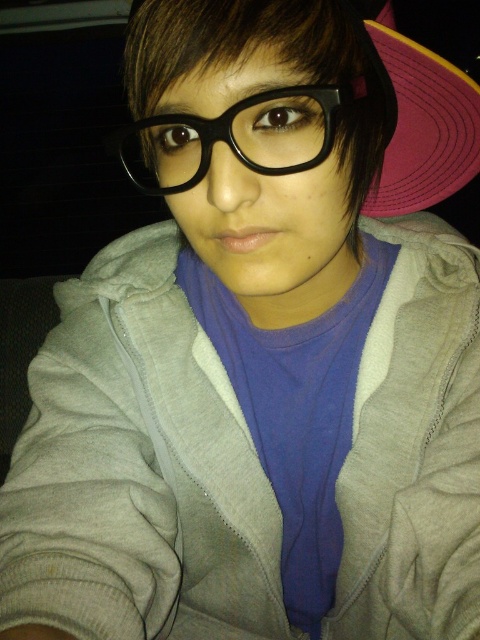
Question: Among these points, which one is farthest from the camera?

Choices:
 (A) (369, 33)
 (B) (155, 115)

Answer: (A)

Question: Among these points, which one is nearest to the camera?

Choices:
 (A) (332, 108)
 (B) (432, 193)

Answer: (A)

Question: Can you confirm if pink fabric baseball hat at upper right is bigger than black plastic glasses at center?

Choices:
 (A) no
 (B) yes

Answer: (B)

Question: Is pink fabric baseball hat at upper right smaller than black plastic glasses at center?

Choices:
 (A) no
 (B) yes

Answer: (A)

Question: Which point is farther from the camera taking this photo?

Choices:
 (A) (301, 154)
 (B) (377, 52)

Answer: (B)

Question: Is pink fabric baseball hat at upper right wider than black plastic glasses at center?

Choices:
 (A) no
 (B) yes

Answer: (B)